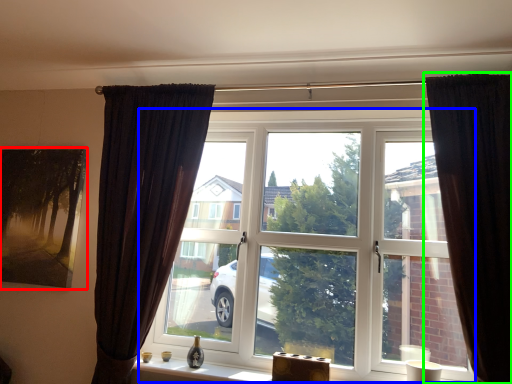
Question: Which object is positioned closest to picture frame (highlighted by a red box)? Select from window (highlighted by a blue box) and curtain (highlighted by a green box).

Choices:
 (A) window
 (B) curtain

Answer: (A)